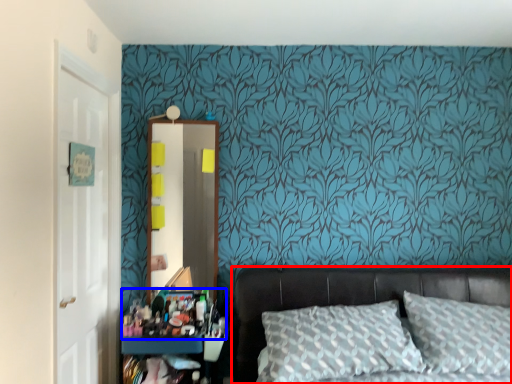
Question: Among these objects, which one is nearest to the camera, bed (highlighted by a red box) or stuff (highlighted by a blue box)?

Choices:
 (A) bed
 (B) stuff

Answer: (A)